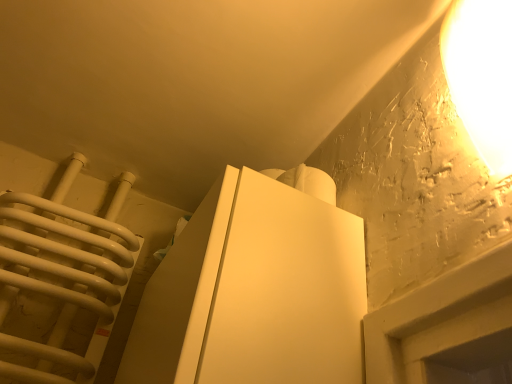
Question: Considering the positions of point (325, 243) and point (459, 8), is point (325, 243) closer or farther from the camera than point (459, 8)?

Choices:
 (A) closer
 (B) farther

Answer: (B)

Question: Do you think white matte cabinet at center is within matte white lampshade at upper right, or outside of it?

Choices:
 (A) inside
 (B) outside

Answer: (B)

Question: Based on their sizes in the image, would you say white matte cabinet at center is bigger or smaller than matte white lampshade at upper right?

Choices:
 (A) big
 (B) small

Answer: (A)

Question: Is matte white lampshade at upper right in front of or behind white matte cabinet at center in the image?

Choices:
 (A) front
 (B) behind

Answer: (A)

Question: In terms of width, does matte white lampshade at upper right look wider or thinner when compared to white matte cabinet at center?

Choices:
 (A) thin
 (B) wide

Answer: (A)

Question: Considering the positions of point (465, 61) and point (324, 235), is point (465, 61) closer or farther from the camera than point (324, 235)?

Choices:
 (A) farther
 (B) closer

Answer: (B)

Question: Is matte white lampshade at upper right bigger or smaller than white matte cabinet at center?

Choices:
 (A) small
 (B) big

Answer: (A)